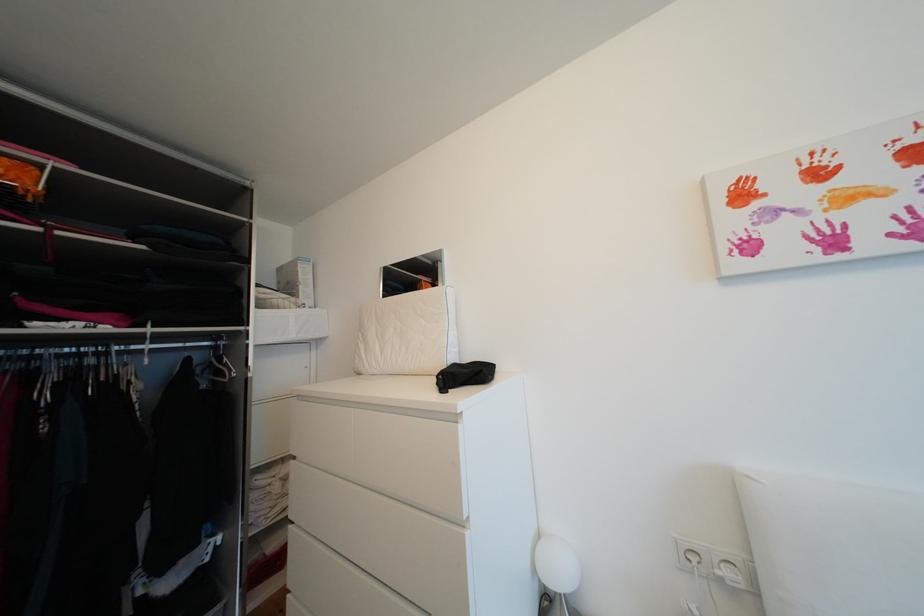
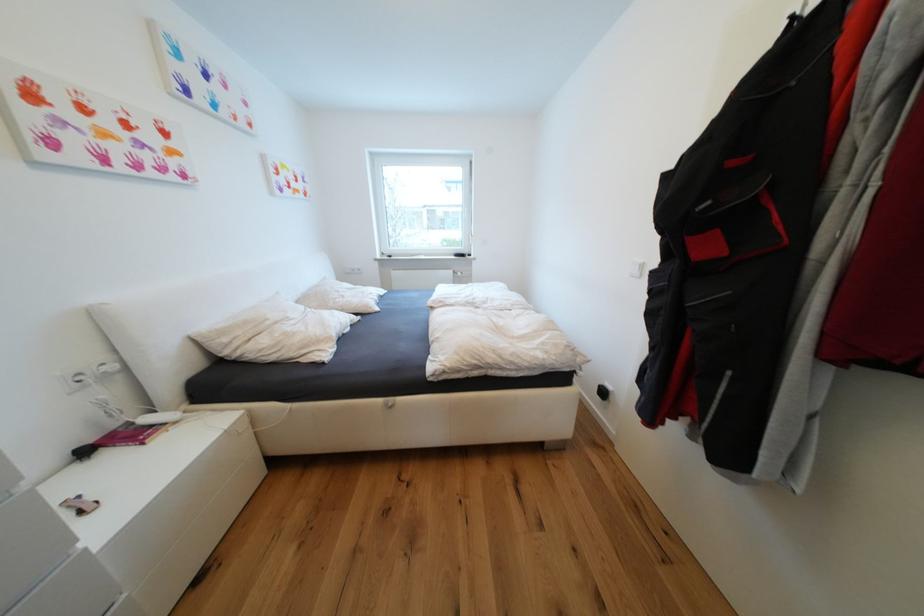
In the second image, find the point that corresponds to [740,580] in the first image.

(119, 369)